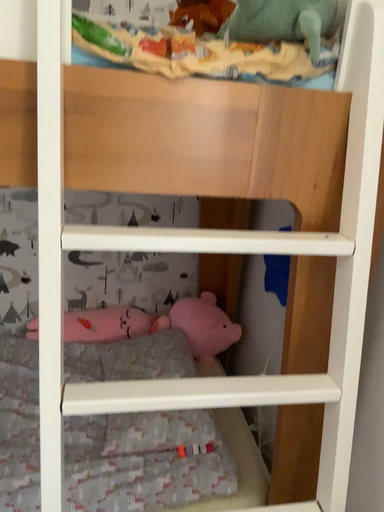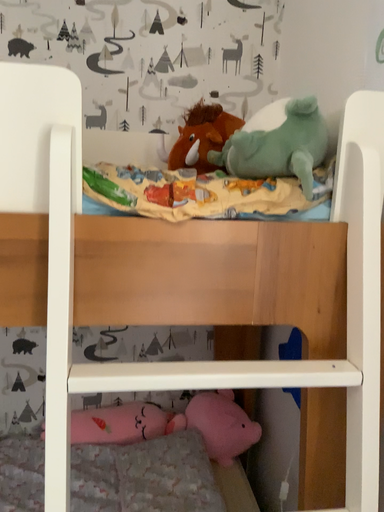
Question: Which way did the camera rotate in the video?

Choices:
 (A) rotated downward
 (B) rotated upward

Answer: (B)